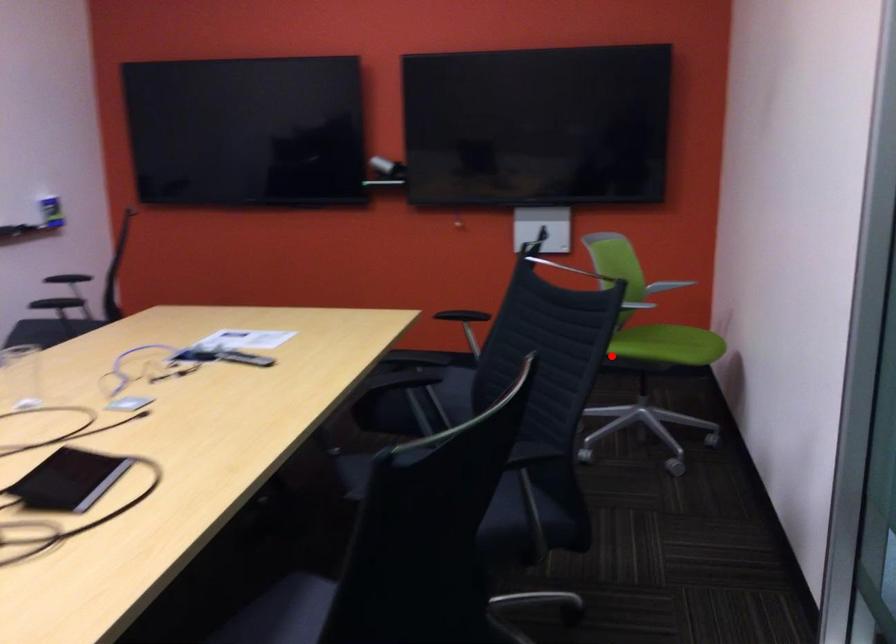
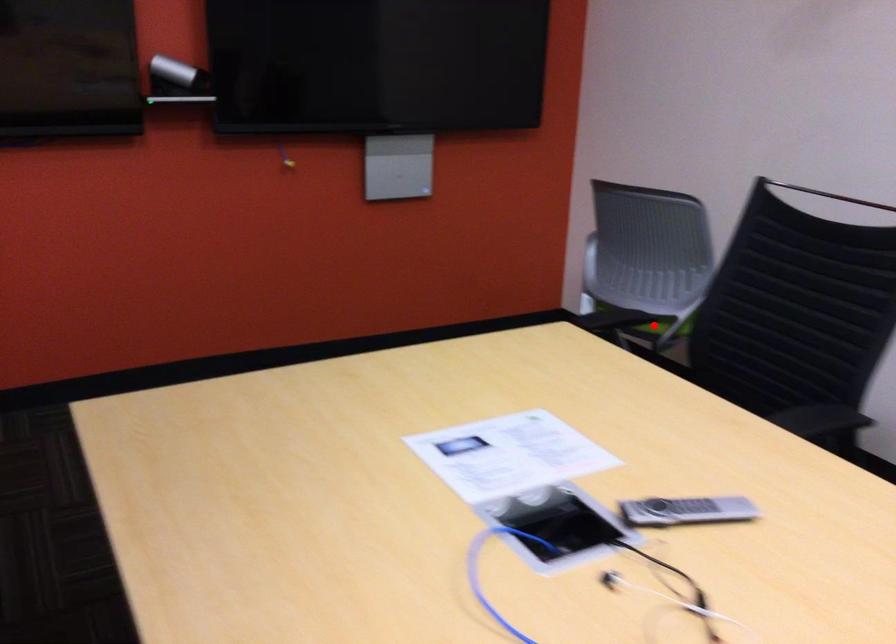
I am providing you with two images of the same scene from different viewpoints. A red point is marked on the first image and another point is marked on the second image. Do the highlighted points in image1 and image2 indicate the same real-world spot?

Yes